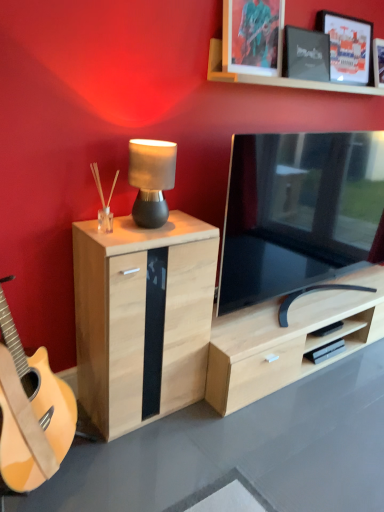
Question: From a real-world perspective, relative to natural wood cabinet at left, is matte black picture frame at upper right, the 3th picture frame when ordered from left to right, vertically above or below?

Choices:
 (A) below
 (B) above

Answer: (B)

Question: Is point (367, 57) closer or farther from the camera than point (91, 248)?

Choices:
 (A) closer
 (B) farther

Answer: (B)

Question: Estimate the real-world distances between objects in this image. Which object is closer to the matte black lamp at center?

Choices:
 (A) black matte picture frame at upper right, the 2th picture frame viewed from the right
 (B) black glossy tv at center
 (C) metallic silver picture frame at upper center, the 1th picture frame viewed from the left
 (D) natural wood cabinet at left
 (E) wooden frame at upper center

Answer: (D)

Question: Considering the real-world distances, which object is closest to the black glossy tv at center?

Choices:
 (A) metallic silver picture frame at upper center, which is counted as the 3th picture frame, starting from the right
 (B) matte black lamp at center
 (C) black matte picture frame at upper right, which is the second picture frame from left to right
 (D) matte black picture frame at upper right, the 3th picture frame when ordered from left to right
 (E) natural wood cabinet at left

Answer: (E)